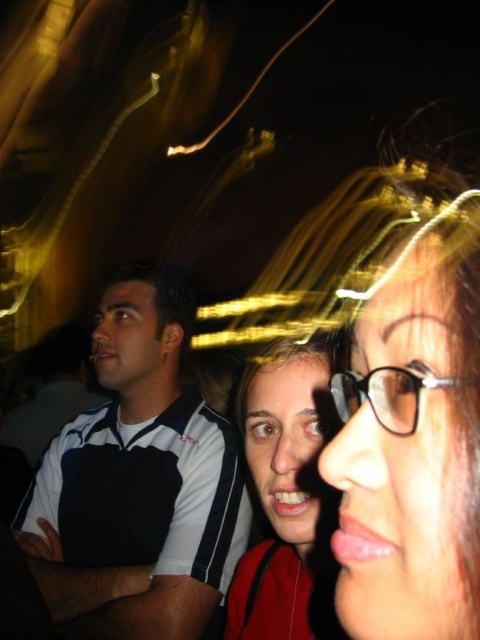
Based on the photo, you are organizing a clothing sale and need to know which item is wider between the white and black striped polo shirt at left and the matte red backpack at center. Based on the image, which one should you list as wider?

The white and black striped polo shirt at left is wider than the matte red backpack at center according to the description.

You are at a night event and want to find the person wearing the white and black striped polo shirt at left. Where should you look relative to the matte red backpack at center?

The white and black striped polo shirt at left is located below the matte red backpack at center, so you should look downward from the matte red backpack at center to find it.